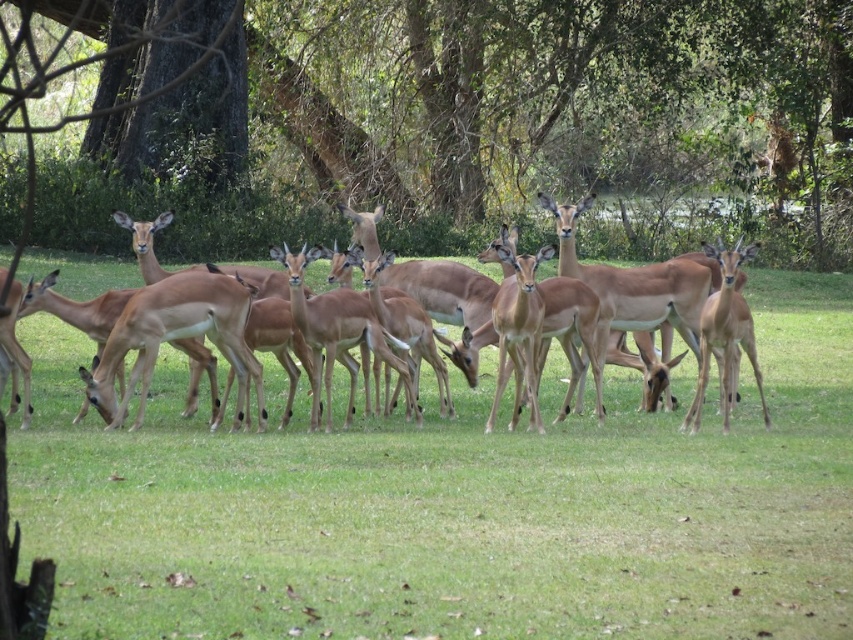
You are a wildlife photographer aiming to capture a photo of the brown smooth antelope at center. You are currently standing at point (457,504). Can you take a clear photo of the brown smooth antelope at center from your current position?

Yes, since you are standing at point (457,504) where the brown smooth antelope at center is located, you can take a clear photo of it from your current position.